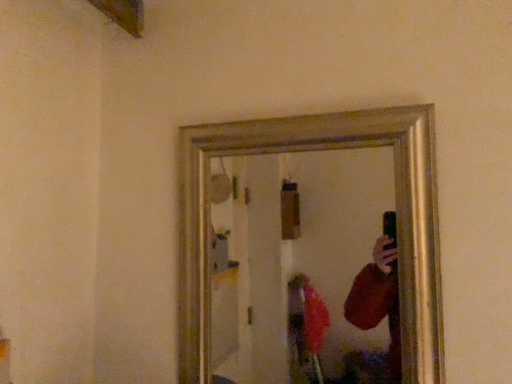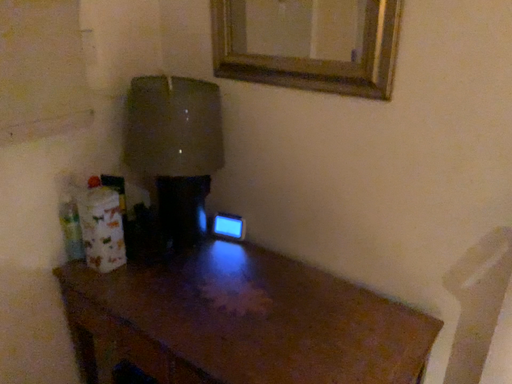
Question: Which way did the camera rotate in the video?

Choices:
 (A) rotated upward
 (B) rotated downward

Answer: (B)